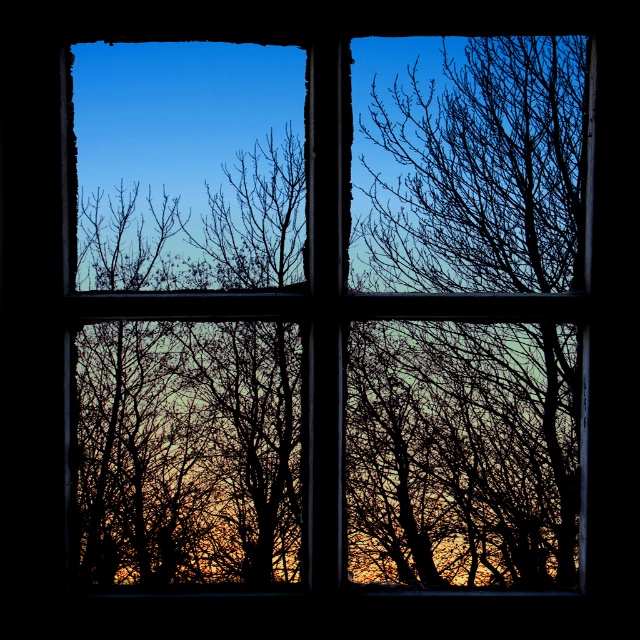
You are standing in a room and want to look outside through the transparent glass window at center. Where should you position yourself to ensure you can see the entire view described in the scene?

The transparent glass window at center is located at point (461, 452), so you should position yourself directly in front of that coordinate to see the entire view described in the scene.

You are an artist sketching the scene outside your window. You notice the transparent glass window at center and the silhouette bare tree at right. Which object is closer to the left edge of your drawing paper?

The transparent glass window at center is positioned on the left side of silhouette bare tree at right, so it is closer to the left edge of the drawing paper.

You are an artist sketching the scene outside your window. You notice the transparent glass window at center and the silhouette bare tree at right. Which object in your view is larger?

The transparent glass window at center is bigger than the silhouette bare tree at right, so the transparent glass window at center is larger.